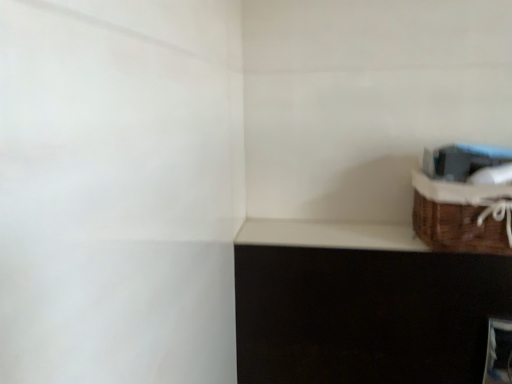
This screenshot has width=512, height=384. I want to click on empty space that is ontop of white matte window sill at upper right (from a real-world perspective), so click(x=335, y=233).